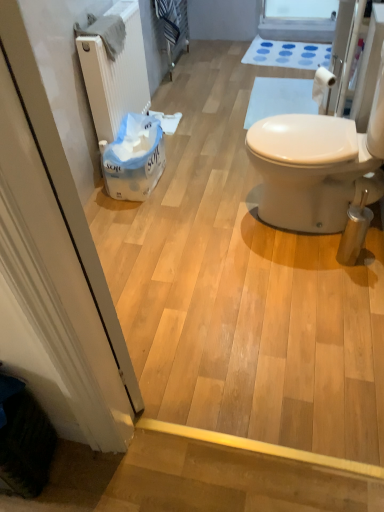
The image size is (384, 512). What are the coordinates of `free space to the right of beige textured radiator at left` in the screenshot? It's located at (198, 146).